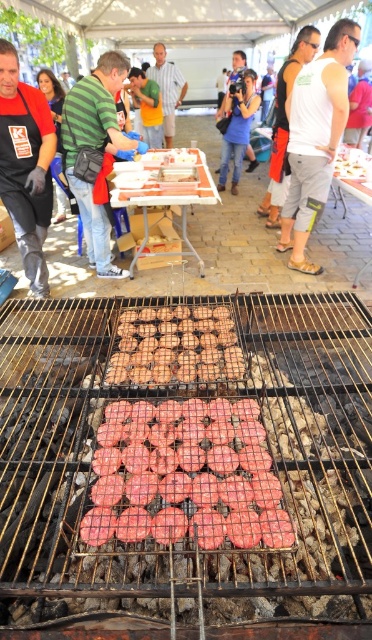
Based on the photo, you are a customer looking to identify the staff members based on their clothing. The scene has a brushed metal apron at left and a white matte tank top at center. Which staff member is standing higher in the image?

The brushed metal apron at left is taller than the white matte tank top at center, so the staff member wearing the brushed metal apron at left is standing higher in the image.

You are a food service worker standing at the grill and you need to retrieve the brown matte eggs at center and the white matte tank top at center. Which object is closer to you?

The brown matte eggs at center is closer to the viewer than the white matte tank top at center, so you can reach the brown matte eggs at center first.